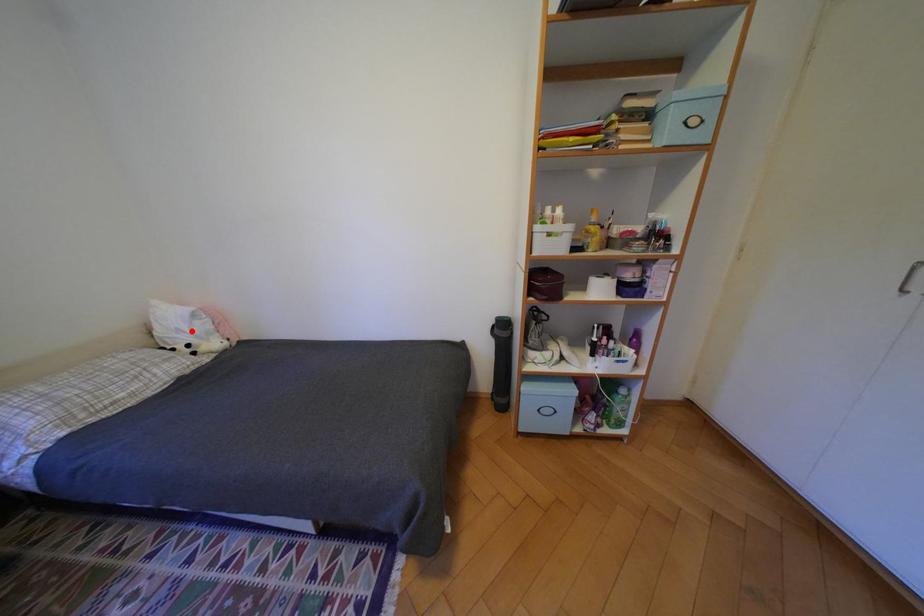
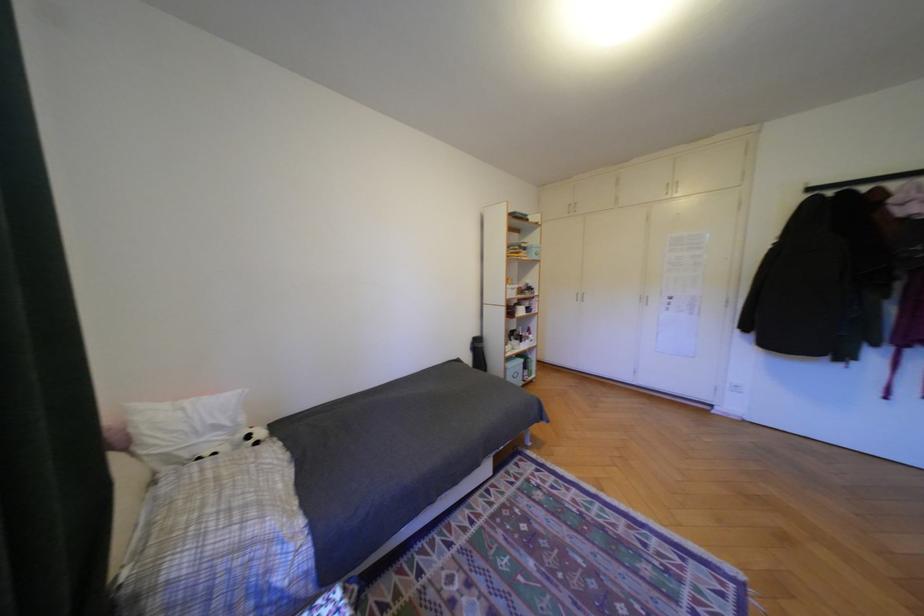
In the second image, find the point that corresponds to the highlighted location in the first image.

(228, 427)